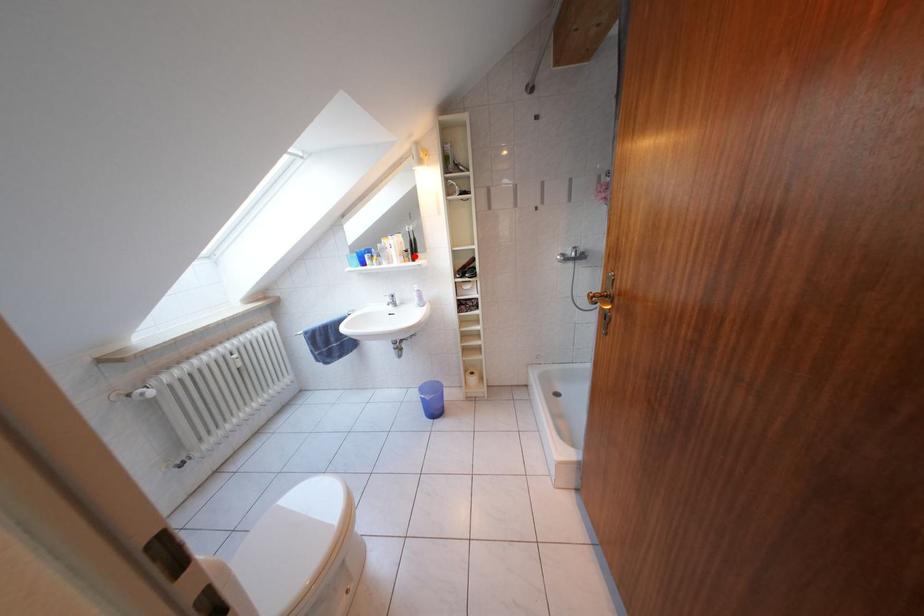
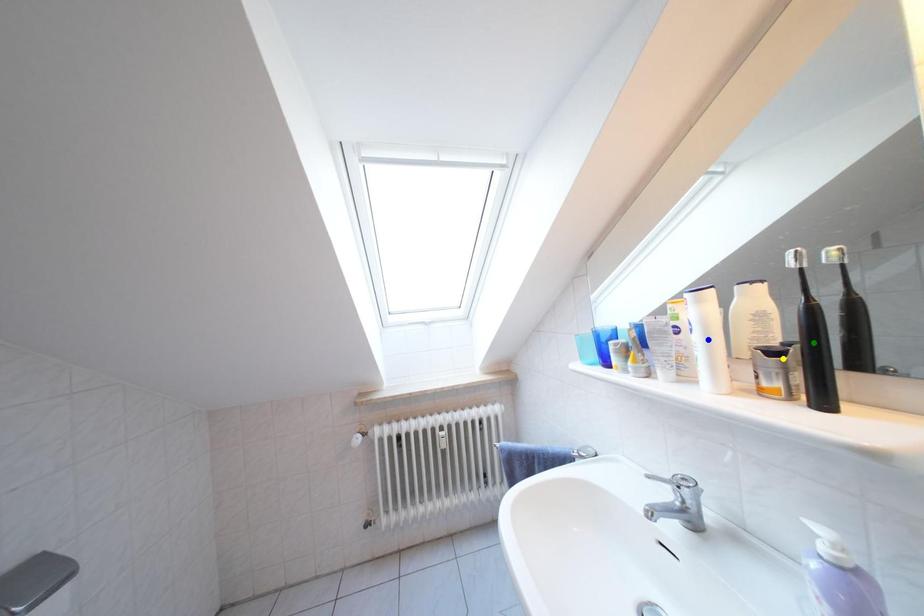
Question: I am providing you with two images of the same scene from different viewpoints. A red point is marked on the first image. You are given multiple points on the second image. Which spot in image 2 lines up with the point in image 1?

Choices:
 (A) blue point
 (B) green point
 (C) yellow point

Answer: (C)